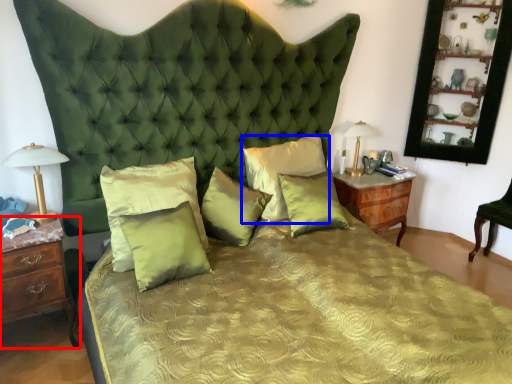
Question: Which object appears closest to the camera in this image, nightstand (highlighted by a red box) or pillow (highlighted by a blue box)?

Choices:
 (A) nightstand
 (B) pillow

Answer: (A)